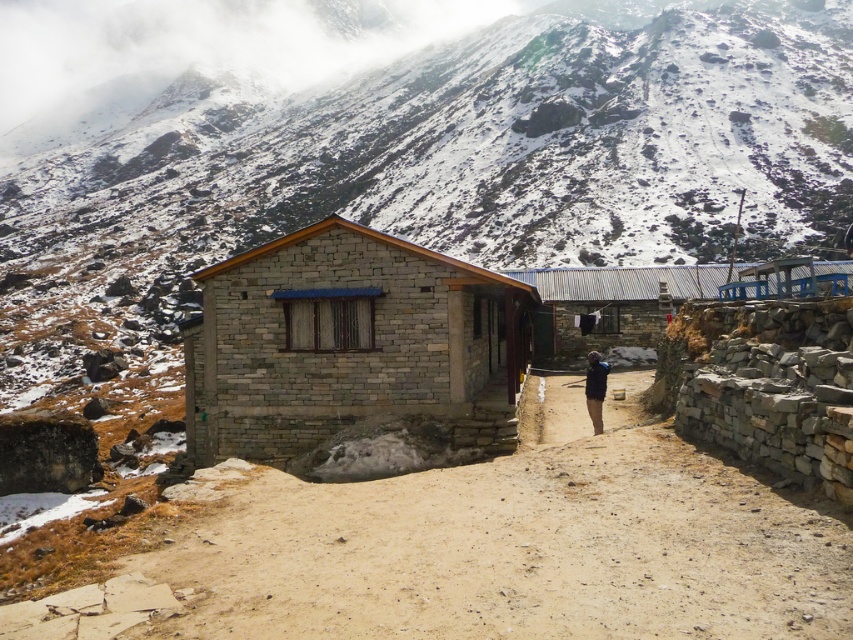
Question: Among these points, which one is nearest to the camera?

Choices:
 (A) (657, 586)
 (B) (831, 264)
 (C) (373, 321)
 (D) (602, 371)

Answer: (A)

Question: Does rustic stone hut at center have a smaller size compared to dark blue jacket at center?

Choices:
 (A) no
 (B) yes

Answer: (A)

Question: Based on their relative distances, which object is farther from the dark blue jacket at center?

Choices:
 (A) rustic stone hut at center
 (B) gray stone hut at center
 (C) brown dirt track at center

Answer: (C)

Question: Can you confirm if gray stone hut at center is positioned to the left of brown dirt path at center?

Choices:
 (A) no
 (B) yes

Answer: (B)

Question: Does brown dirt path at center have a greater width compared to dark blue jacket at center?

Choices:
 (A) yes
 (B) no

Answer: (A)

Question: Among these points, which one is nearest to the camera?

Choices:
 (A) (291, 532)
 (B) (550, 435)

Answer: (A)